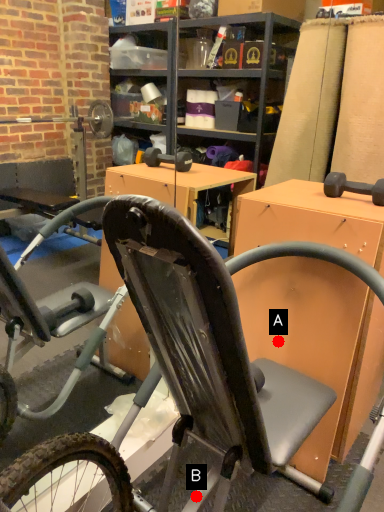
Question: Two points are circled on the image, labeled by A and B beside each circle. Which point is closer to the camera taking this photo?

Choices:
 (A) A is closer
 (B) B is closer

Answer: (B)